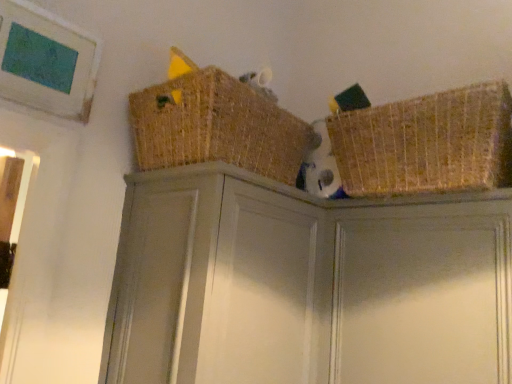
What do you see at coordinates (217, 126) in the screenshot? This screenshot has width=512, height=384. I see `woven straw basket at upper center, the 1th basket positioned from the left` at bounding box center [217, 126].

The width and height of the screenshot is (512, 384). I want to click on matte gray cabinet at center, so (306, 285).

Is there a large distance between matte gray cabinet at center and woven straw basket at upper center, the 1th basket positioned from the left?

matte gray cabinet at center is near woven straw basket at upper center, the 1th basket positioned from the left, not far away.

Based on the photo, in the image, is matte gray cabinet at center positioned in front of or behind woven straw basket at upper center, the second basket in the right-to-left sequence?

matte gray cabinet at center is positioned closer to the viewer than woven straw basket at upper center, the second basket in the right-to-left sequence.

Considering the positions of point (155, 318) and point (188, 122), is point (155, 318) closer or farther from the camera than point (188, 122)?

Point (155, 318) appears to be closer to the viewer than point (188, 122).

From a real-world perspective, which object stands above the other?

In real-world perspective, woven straw basket at upper center, the second basket in the right-to-left sequence, is above.

From a real-world perspective, is woven straw basket at upper right, which appears as the 2th basket when viewed from the left, under matte gray cabinet at center?

No, from a real-world perspective, woven straw basket at upper right, which appears as the 2th basket when viewed from the left, is not below matte gray cabinet at center.

From the image's perspective, is woven straw basket at upper right, which appears as the 2th basket when viewed from the left, located above matte gray cabinet at center?

Yes, from the image's perspective, woven straw basket at upper right, which appears as the 2th basket when viewed from the left, is over matte gray cabinet at center.

From a real-world perspective, starting from the matte gray cabinet at center, which basket is the 1st one vertically above it? Please provide its 2D coordinates.

[(426, 143)]

Is woven straw basket at upper right, which appears as the 2th basket when viewed from the left, wider or thinner than matte gray cabinet at center?

woven straw basket at upper right, which appears as the 2th basket when viewed from the left, is thinner than matte gray cabinet at center.

You are a GUI agent. You are given a task and a screenshot of the screen. Output one action in this format:
    pyautogui.click(x=<x>, y=<y>)
    Task: Click on the 1st basket above the matte gray cabinet at upper right (from a real-world perspective)
    
    Given the screenshot: What is the action you would take?
    pyautogui.click(x=426, y=143)

Between point (382, 280) and point (496, 161), which one is positioned behind?

The point (382, 280) is behind.

Is matte gray cabinet at upper right behind woven straw basket at upper right, which appears as the 2th basket when viewed from the left?

No, it is in front of woven straw basket at upper right, which appears as the 2th basket when viewed from the left.

How many degrees apart are the facing directions of woven straw basket at upper center, the 1th basket positioned from the left, and matte gray cabinet at upper right?

The facing directions of woven straw basket at upper center, the 1th basket positioned from the left, and matte gray cabinet at upper right are 89.8 degrees apart.

Which object is thinner, woven straw basket at upper center, the 1th basket positioned from the left, or matte gray cabinet at upper right?

With smaller width is matte gray cabinet at upper right.

Is woven straw basket at upper center, the second basket in the right-to-left sequence, not inside matte gray cabinet at upper right?

That's correct, woven straw basket at upper center, the second basket in the right-to-left sequence, is outside of matte gray cabinet at upper right.

Which object is positioned more to the left, woven straw basket at upper center, the second basket in the right-to-left sequence, or matte gray cabinet at upper right?

woven straw basket at upper center, the second basket in the right-to-left sequence.

From a real-world perspective, who is located higher, matte gray cabinet at upper right or woven straw basket at upper center, the 1th basket positioned from the left?

woven straw basket at upper center, the 1th basket positioned from the left.

Is woven straw basket at upper center, the 1th basket positioned from the left, a part of matte gray cabinet at upper right?

Definitely not — woven straw basket at upper center, the 1th basket positioned from the left, is not inside matte gray cabinet at upper right.

Which point is more distant from viewer, [503,301] or [271,126]?

The point [271,126] is farther from the camera.

Is woven straw basket at upper center, the 1th basket positioned from the left, taller or shorter than woven straw basket at upper right, the first basket viewed from the right?

Clearly, woven straw basket at upper center, the 1th basket positioned from the left, is shorter compared to woven straw basket at upper right, the first basket viewed from the right.

Can we say woven straw basket at upper center, the second basket in the right-to-left sequence, lies outside woven straw basket at upper right, the first basket viewed from the right?

That's correct, woven straw basket at upper center, the second basket in the right-to-left sequence, is outside of woven straw basket at upper right, the first basket viewed from the right.

Are woven straw basket at upper center, the second basket in the right-to-left sequence, and woven straw basket at upper right, which appears as the 2th basket when viewed from the left, beside each other?

No, woven straw basket at upper center, the second basket in the right-to-left sequence, is not in contact with woven straw basket at upper right, which appears as the 2th basket when viewed from the left.

From the image's perspective, is woven straw basket at upper center, the 1th basket positioned from the left, under woven straw basket at upper right, the first basket viewed from the right?

Actually, woven straw basket at upper center, the 1th basket positioned from the left, appears above woven straw basket at upper right, the first basket viewed from the right, in the image.

From a real-world perspective, is matte gray cabinet at upper right beneath matte gray cabinet at center?

No, from a real-world perspective, matte gray cabinet at upper right is not under matte gray cabinet at center.

Which is correct: matte gray cabinet at upper right is inside matte gray cabinet at center, or outside of it?

matte gray cabinet at upper right is not enclosed by matte gray cabinet at center.

Which object is positioned more to the right, matte gray cabinet at upper right or matte gray cabinet at center?

Positioned to the right is matte gray cabinet at upper right.

You are a GUI agent. You are given a task and a screenshot of the screen. Output one action in this format:
    pyautogui.click(x=<x>, y=<y>)
    Task: Click on the basket located on the left of matte gray cabinet at center
    The width and height of the screenshot is (512, 384).
    Given the screenshot: What is the action you would take?
    pyautogui.click(x=217, y=126)

Starting from the matte gray cabinet at center, which basket is the 1st one behind? Please provide its 2D coordinates.

[(426, 143)]

Looking at the image, which one is located closer to matte gray cabinet at center, woven straw basket at upper right, the first basket viewed from the right, or matte gray cabinet at upper right?

matte gray cabinet at upper right.

Estimate the real-world distances between objects in this image. Which object is further from woven straw basket at upper center, the second basket in the right-to-left sequence, woven straw basket at upper right, the first basket viewed from the right, or matte gray cabinet at center?

Among the two, woven straw basket at upper right, the first basket viewed from the right, is located further to woven straw basket at upper center, the second basket in the right-to-left sequence.

From the image, which object appears to be nearer to woven straw basket at upper center, the 1th basket positioned from the left, matte gray cabinet at center or woven straw basket at upper right, which appears as the 2th basket when viewed from the left?

matte gray cabinet at center is positioned closer to the anchor woven straw basket at upper center, the 1th basket positioned from the left.

Considering their positions, is matte gray cabinet at upper right positioned further to woven straw basket at upper center, the 1th basket positioned from the left, than woven straw basket at upper right, the first basket viewed from the right?

Based on the image, matte gray cabinet at upper right appears to be further to woven straw basket at upper center, the 1th basket positioned from the left.

Based on their spatial positions, is woven straw basket at upper center, the 1th basket positioned from the left, or matte gray cabinet at upper right further from woven straw basket at upper right, the first basket viewed from the right?

woven straw basket at upper center, the 1th basket positioned from the left, lies further to woven straw basket at upper right, the first basket viewed from the right, than the other object.

Which object lies nearer to the anchor point matte gray cabinet at upper right, woven straw basket at upper right, which appears as the 2th basket when viewed from the left, or matte gray cabinet at center?

matte gray cabinet at center is closer to matte gray cabinet at upper right.

When comparing their distances from matte gray cabinet at center, does matte gray cabinet at upper right or woven straw basket at upper center, the second basket in the right-to-left sequence, seem closer?

matte gray cabinet at upper right is positioned closer to the anchor matte gray cabinet at center.

From the image, which object appears to be farther from matte gray cabinet at upper right, woven straw basket at upper right, which appears as the 2th basket when viewed from the left, or woven straw basket at upper center, the 1th basket positioned from the left?

woven straw basket at upper center, the 1th basket positioned from the left, is positioned further to the anchor matte gray cabinet at upper right.

The width and height of the screenshot is (512, 384). I want to click on door between woven straw basket at upper center, the 1th basket positioned from the left, and woven straw basket at upper right, which appears as the 2th basket when viewed from the left, from left to right, so click(x=423, y=296).

Where is `cabinetry between woven straw basket at upper center, the second basket in the right-to-left sequence, and matte gray cabinet at upper right, in the horizontal direction`? The width and height of the screenshot is (512, 384). cabinetry between woven straw basket at upper center, the second basket in the right-to-left sequence, and matte gray cabinet at upper right, in the horizontal direction is located at coordinates (306, 285).

Where is `door between matte gray cabinet at center and woven straw basket at upper right, the first basket viewed from the right, in the horizontal direction`? door between matte gray cabinet at center and woven straw basket at upper right, the first basket viewed from the right, in the horizontal direction is located at coordinates (423, 296).

The height and width of the screenshot is (384, 512). I want to click on cabinetry between woven straw basket at upper center, the second basket in the right-to-left sequence, and woven straw basket at upper right, the first basket viewed from the right, from left to right, so click(306, 285).